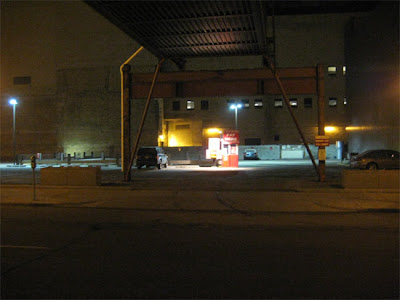
Find the location of a particular element. Image resolution: width=400 pixels, height=300 pixels. windows is located at coordinates (330, 71), (330, 103), (190, 105), (176, 106), (256, 104).